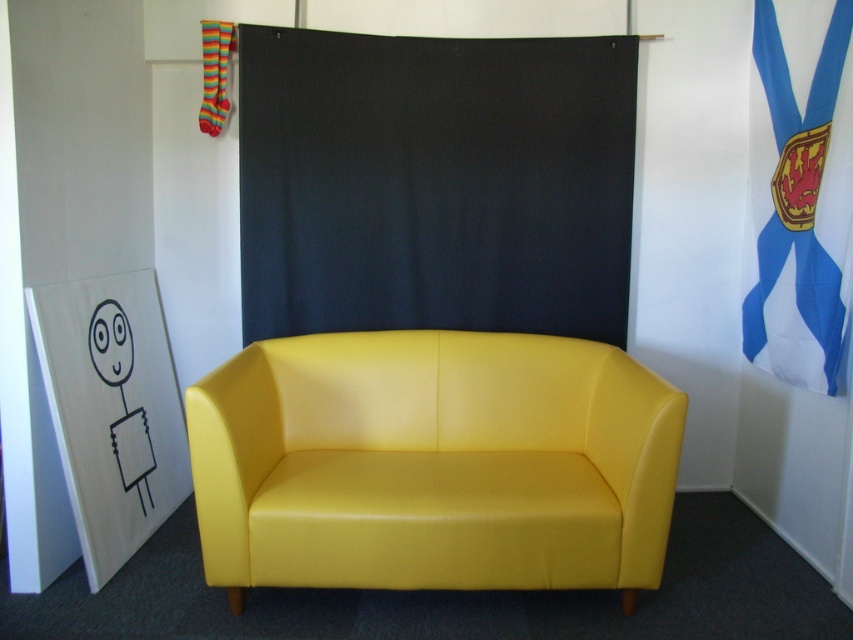
Does point (433, 573) come farther from viewer compared to point (553, 36)?

No.

Which is above, yellow leather armchair at center or black fabric curtain at center?

black fabric curtain at center is above.

Find the location of a particular element. yellow leather armchair at center is located at coordinates (433, 464).

Locate an element on the screen. The height and width of the screenshot is (640, 853). yellow leather armchair at center is located at coordinates (433, 464).

Between point (577, 524) and point (804, 220), which one is positioned in front?

Point (577, 524) is more forward.

Identify the location of yellow leather armchair at center. (433, 464).

Where is `yellow leather armchair at center`? yellow leather armchair at center is located at coordinates (433, 464).

Who is shorter, black fabric curtain at center or blue fabric flag at upper right?

black fabric curtain at center

Find the location of a particular element. The width and height of the screenshot is (853, 640). black fabric curtain at center is located at coordinates (434, 182).